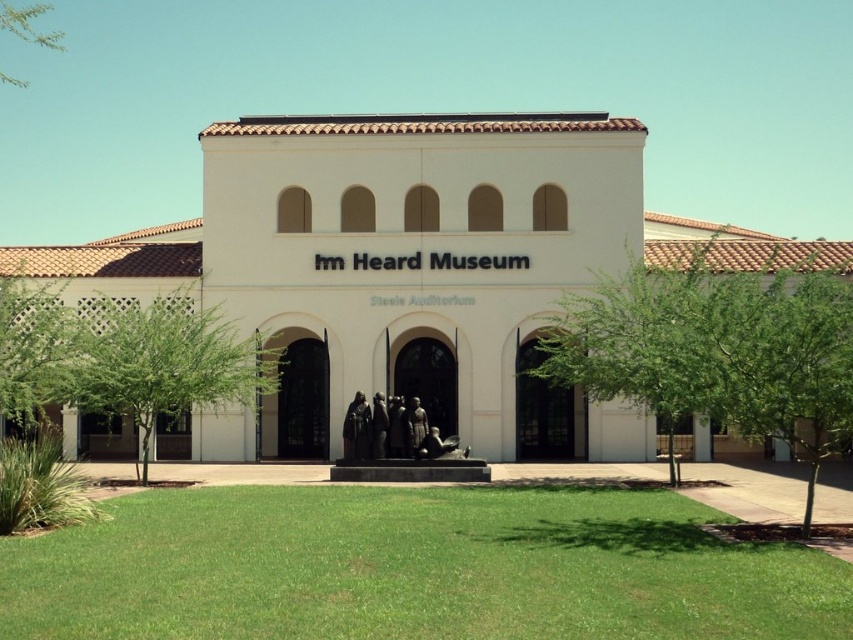
You are a visitor at the Heard Museum and want to take a photo of both the green leafy tree at center and the green leafy tree at left. Which tree should you stand closer to in order to include both in your camera frame?

You should stand closer to the green leafy tree at left because it is smaller in size compared to the green leafy tree at center. This way, both trees will appear balanced in the camera frame.

You are a visitor at the Heard Museum and want to take a photo of the entrance. You notice two green leafy trees in the scene. Which tree, the green leafy tree at lower left or the green leafy tree at upper left, is positioned to the right of the other?

The green leafy tree at lower left is positioned to the right of the green leafy tree at upper left.